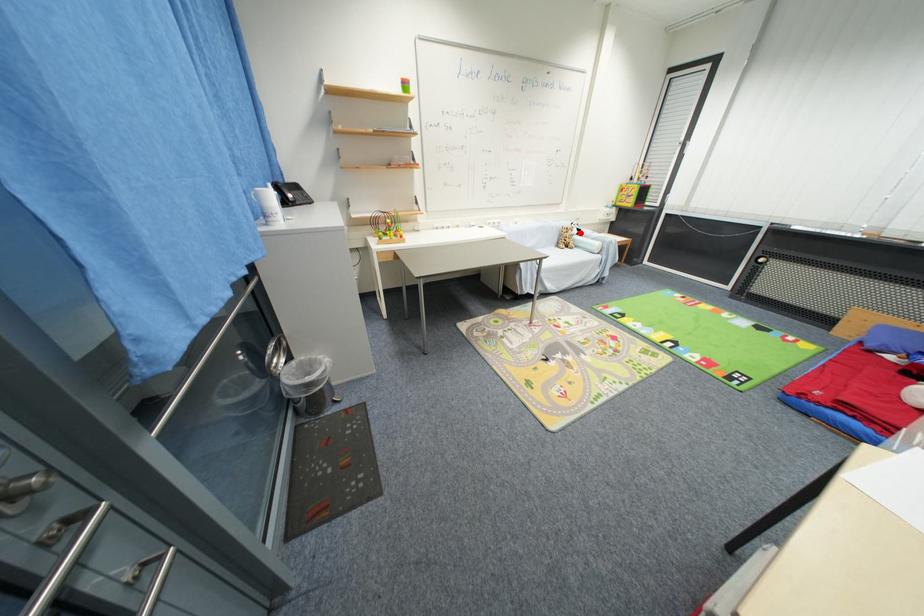
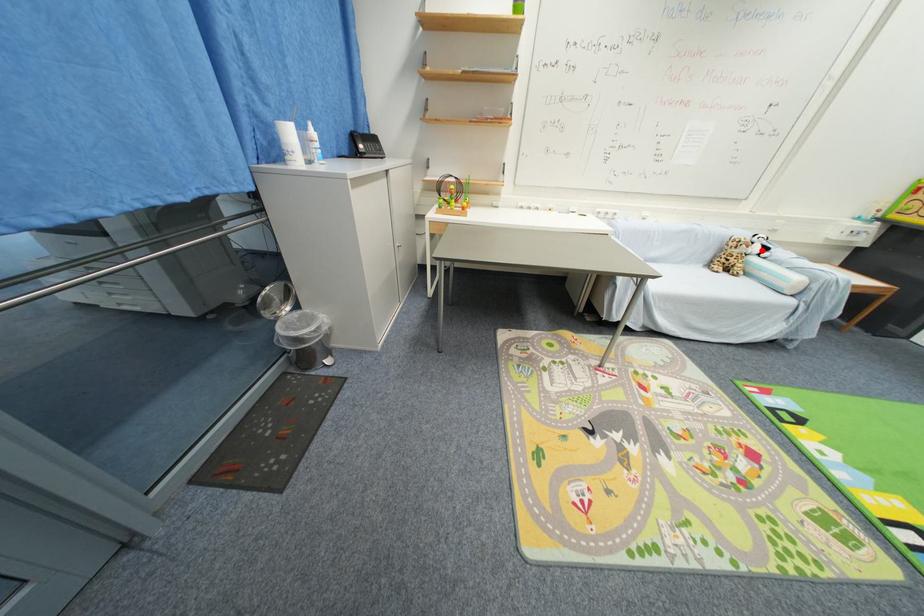
I am providing you with two images of the same scene from different viewpoints. A red point is marked on the first image and another point is marked on the second image. Is the marked point in image1 the same physical position as the marked point in image2?

Yes